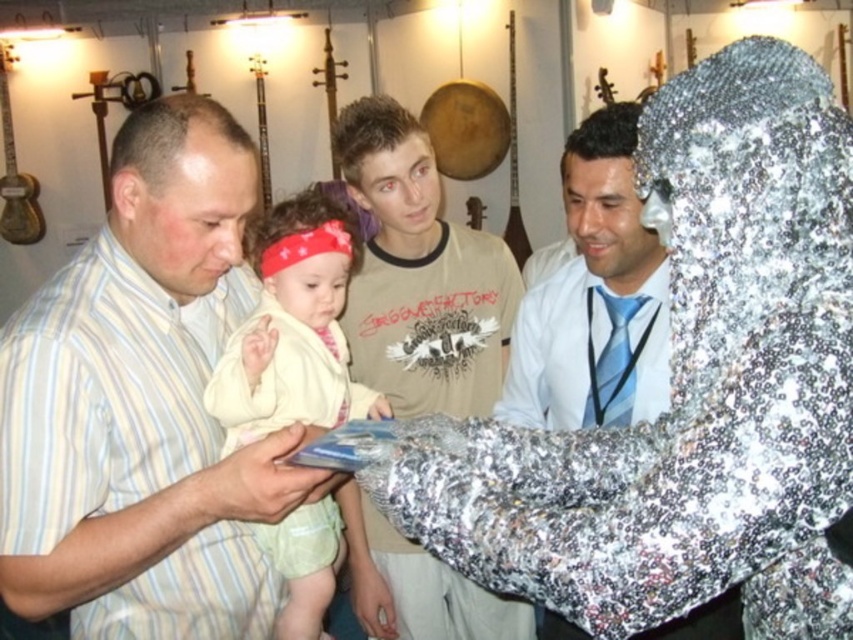
Question: Is shiny sequined jacket at center further to the viewer compared to blue silk tie at center?

Choices:
 (A) yes
 (B) no

Answer: (B)

Question: Which object is the closest to the striped cotton shirt at center?

Choices:
 (A) shiny sequined jacket at center
 (B) light yellow fabric baby at center
 (C) matte beige t-shirt at center
 (D) blue silk tie at center

Answer: (B)

Question: Is striped cotton shirt at center closer to camera compared to light yellow fabric baby at center?

Choices:
 (A) yes
 (B) no

Answer: (A)

Question: Which of the following is the farthest from the observer?

Choices:
 (A) shiny sequined jacket at center
 (B) light yellow fabric baby at center
 (C) blue silk tie at center

Answer: (C)

Question: Is matte beige t-shirt at center below shiny sequined jacket at center?

Choices:
 (A) yes
 (B) no

Answer: (B)

Question: Which point is closer to the camera taking this photo?

Choices:
 (A) (325, 252)
 (B) (606, 307)
 (C) (624, 120)
 (D) (341, 326)

Answer: (A)